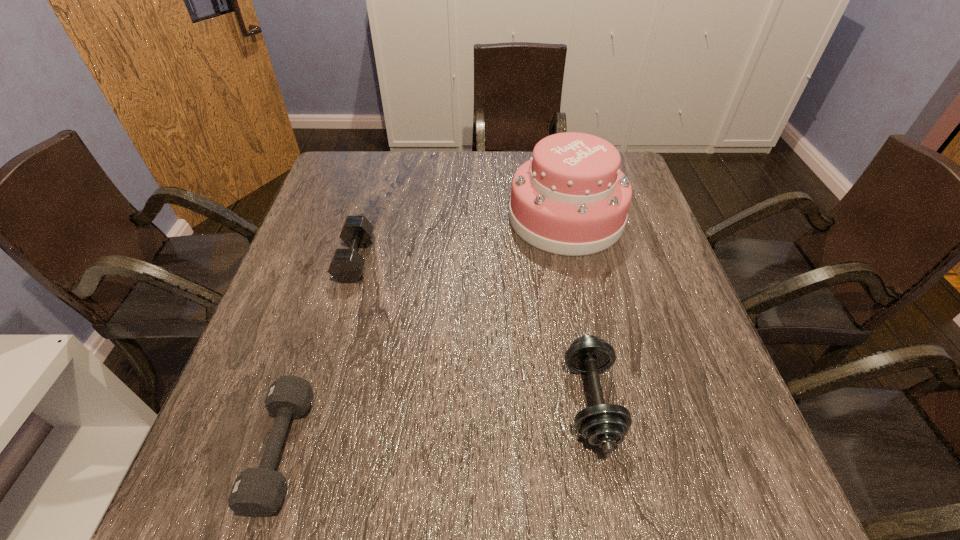
Find the location of a particular element. object located in the near left corner section of the desktop is located at coordinates (257, 492).

You are a GUI agent. You are given a task and a screenshot of the screen. Output one action in this format:
    pyautogui.click(x=<x>, y=<y>)
    Task: Click on the object that is positioned at the far right corner
    The height and width of the screenshot is (540, 960).
    Given the screenshot: What is the action you would take?
    pyautogui.click(x=571, y=198)

In the image, there is a desktop. In order to click on free region at the far edge in this screenshot , I will do `click(486, 164)`.

This screenshot has width=960, height=540. In order to click on free space at the near edge of the desktop in this screenshot , I will do `click(538, 521)`.

The image size is (960, 540). Find the location of `vacant position at the left edge of the desktop`. vacant position at the left edge of the desktop is located at coordinates (228, 404).

In order to click on vacant space at the right edge of the desktop in this screenshot , I will do `click(649, 217)`.

You are a GUI agent. You are given a task and a screenshot of the screen. Output one action in this format:
    pyautogui.click(x=<x>, y=<y>)
    Task: Click on the free space at the far left corner of the desktop
    
    Given the screenshot: What is the action you would take?
    (x=370, y=177)

The image size is (960, 540). Find the location of `vacant area at the near left corner of the desktop`. vacant area at the near left corner of the desktop is located at coordinates (180, 512).

What are the coordinates of `vacant space that is in between the cake and the tallest dumbbell` in the screenshot? It's located at (579, 309).

Image resolution: width=960 pixels, height=540 pixels. Find the location of `vacant area that lies between the second tallest object and the tallest object`. vacant area that lies between the second tallest object and the tallest object is located at coordinates [x=579, y=309].